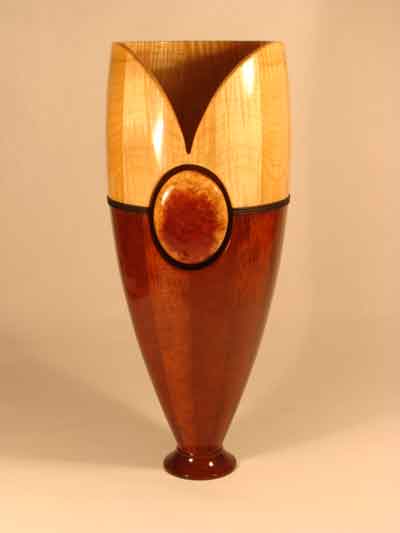
Identify the location of wooden base. The width and height of the screenshot is (400, 533). (210, 469).